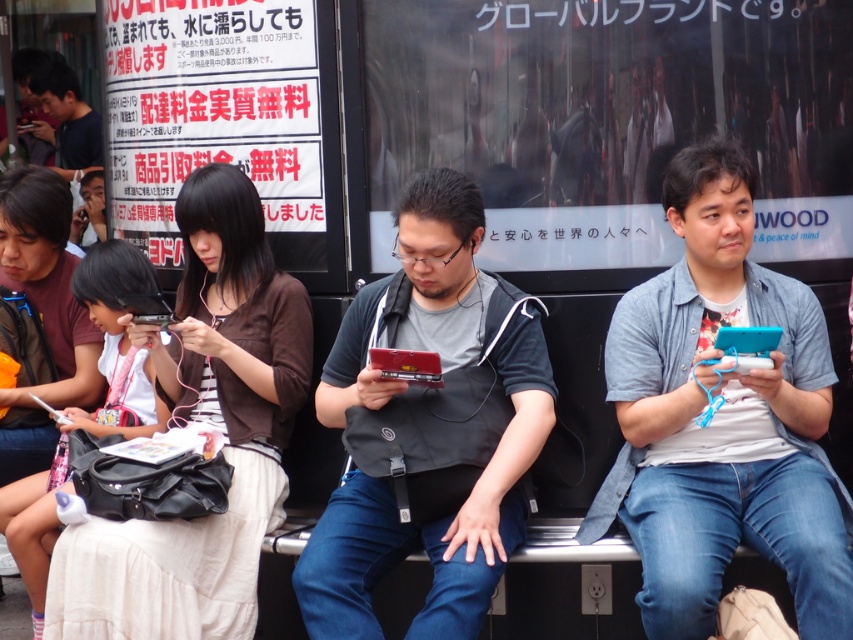
You are a person who wants to compare the sizes of the blue matte phone at right and the matte black handheld gaming console at center. Based on the scene, which one is larger?

The blue matte phone at right is bigger than the matte black handheld gaming console at center, so the blue matte phone at right is larger.

You are a photographer standing at the camera position. You want to take a photo of the blue matte phone at right. Is it possible to capture the entire phone in the frame without zooming?

The blue matte phone at right is 3.81 meters from the camera. Since it is at a moderate distance, it should be possible to capture the entire phone in the frame without zooming, provided the camera has a wide enough angle. However, exact framing depends on the camera specifications.

You are standing in front of the bench where the five people are sitting. You notice two points marked on the ground near the bench. One is at coordinate point (753, 477) and the other at point (343, 336). Which of these two points is closer to you?

The point at coordinate (753, 477) is closer to you than the point at (343, 336).